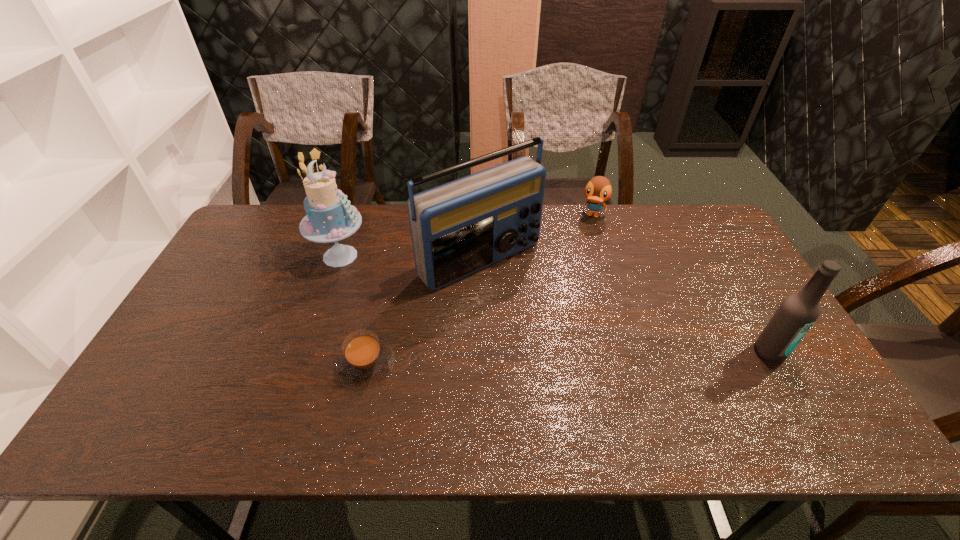
Point out which object is positioned as the third nearest to the third object from left to right. Please provide its 2D coordinates. Your answer should be formatted as a tuple, i.e. [(x, y)], where the tuple contains the x and y coordinates of a point satisfying the conditions above.

[(365, 360)]

Identify the location of vacant position in the image that satisfies the following two spatial constraints: 1. on the front side of the cake; 2. on the left side of the third object from right to left. The width and height of the screenshot is (960, 540). (339, 259).

Find the location of a particular element. free location that satisfies the following two spatial constraints: 1. on the back side of the fourth tallest object; 2. on the left side of the cappuccino is located at coordinates (399, 215).

At what (x,y) coordinates should I click in order to perform the action: click on free location that satisfies the following two spatial constraints: 1. on the back side of the third object from right to left; 2. on the right side of the fourth object from left to right. Please return your answer as a coordinate pair (x, y). Image resolution: width=960 pixels, height=540 pixels. Looking at the image, I should click on (480, 215).